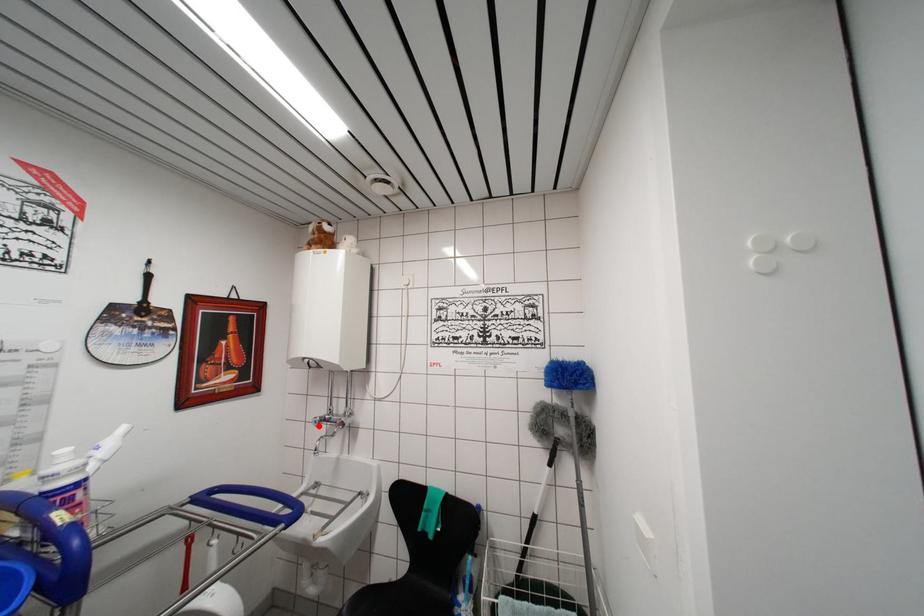
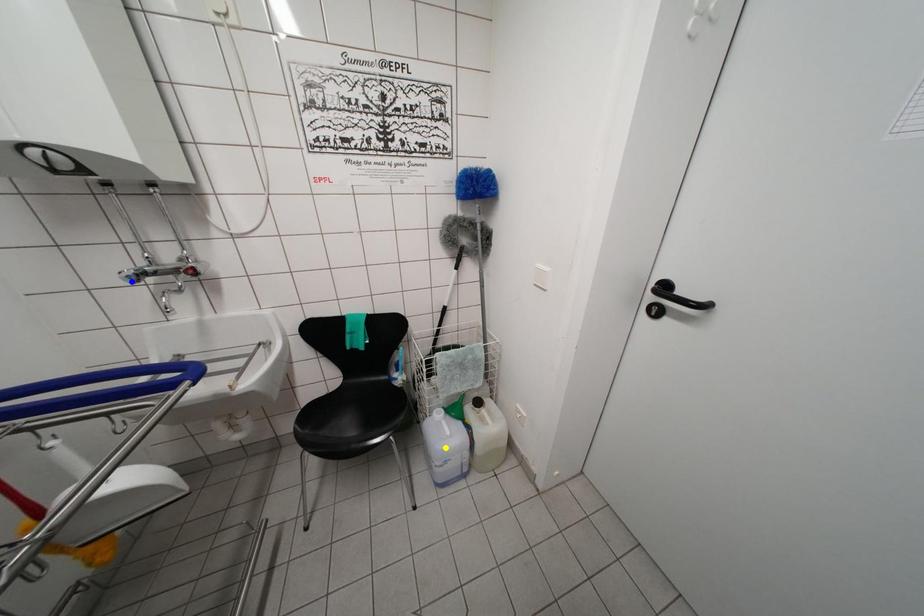
Question: I am providing you with two images of the same scene from different viewpoints. A red point is marked on the first image. You are given multiple points on the second image. Which point in image 2 represents the same 3d spot as the red point in image 1?

Choices:
 (A) green point
 (B) blue point
 (C) yellow point

Answer: (B)